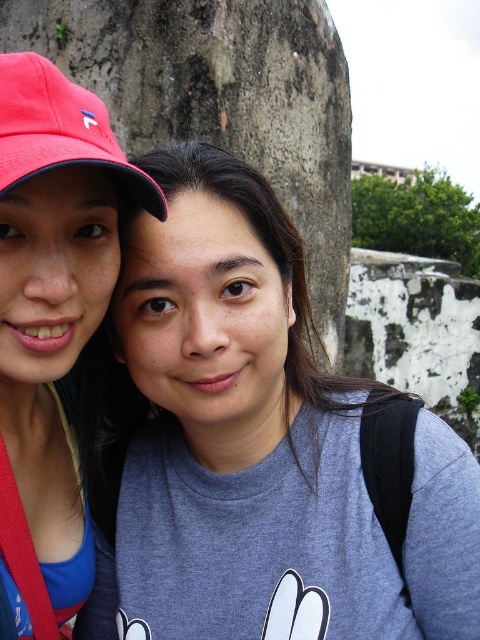
Does matte pink cap at left have a smaller size compared to matte red baseball cap at upper left?

Incorrect, matte pink cap at left is not smaller in size than matte red baseball cap at upper left.

Who is positioned more to the right, matte pink cap at left or matte red baseball cap at upper left?

Positioned to the right is matte red baseball cap at upper left.

Is point (35, 576) closer to camera compared to point (130, 182)?

Yes, point (35, 576) is closer to viewer.

Where is `matte pink cap at left`? matte pink cap at left is located at coordinates (50, 326).

Where is `gray matte t-shirt at center`? The width and height of the screenshot is (480, 640). gray matte t-shirt at center is located at coordinates (253, 444).

Is gray matte t-shirt at center wider than matte pink cap at left?

Yes.

Find the location of `gray matte t-shirt at center`. gray matte t-shirt at center is located at coordinates (253, 444).

Identify the location of gray matte t-shirt at center. The width and height of the screenshot is (480, 640). (253, 444).

Does gray matte t-shirt at center appear over matte red baseball cap at upper left?

No.

Does gray matte t-shirt at center have a greater height compared to matte red baseball cap at upper left?

Correct, gray matte t-shirt at center is much taller as matte red baseball cap at upper left.

Locate an element on the screen. The width and height of the screenshot is (480, 640). gray matte t-shirt at center is located at coordinates (253, 444).